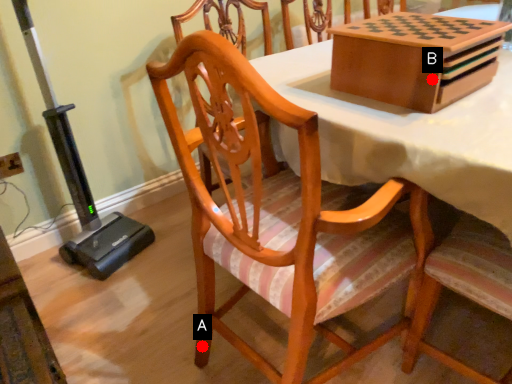
Question: Two points are circled on the image, labeled by A and B beside each circle. Which point is closer to the camera?

Choices:
 (A) A is closer
 (B) B is closer

Answer: (B)